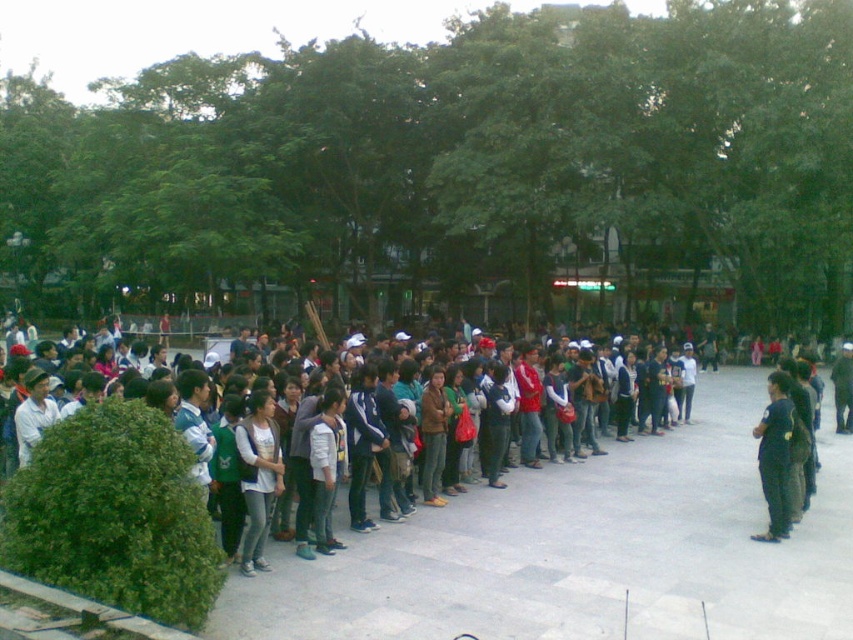
Question: Which point is closer to the camera?

Choices:
 (A) light gray fabric jacket at center
 (B) dark blue uniform at center

Answer: (A)

Question: Does light gray fabric jacket at center have a larger size compared to dark blue uniform at center?

Choices:
 (A) yes
 (B) no

Answer: (A)

Question: Does light gray fabric jacket at center have a lesser width compared to dark blue uniform at center?

Choices:
 (A) yes
 (B) no

Answer: (B)

Question: Observing the image, what is the correct spatial positioning of light gray fabric jacket at center in reference to dark blue uniform at center?

Choices:
 (A) left
 (B) right

Answer: (A)

Question: Which of the following is the closest to the observer?

Choices:
 (A) (252, 460)
 (B) (787, 381)

Answer: (A)

Question: Which point is farther from the camera taking this photo?

Choices:
 (A) (764, 429)
 (B) (260, 496)

Answer: (A)